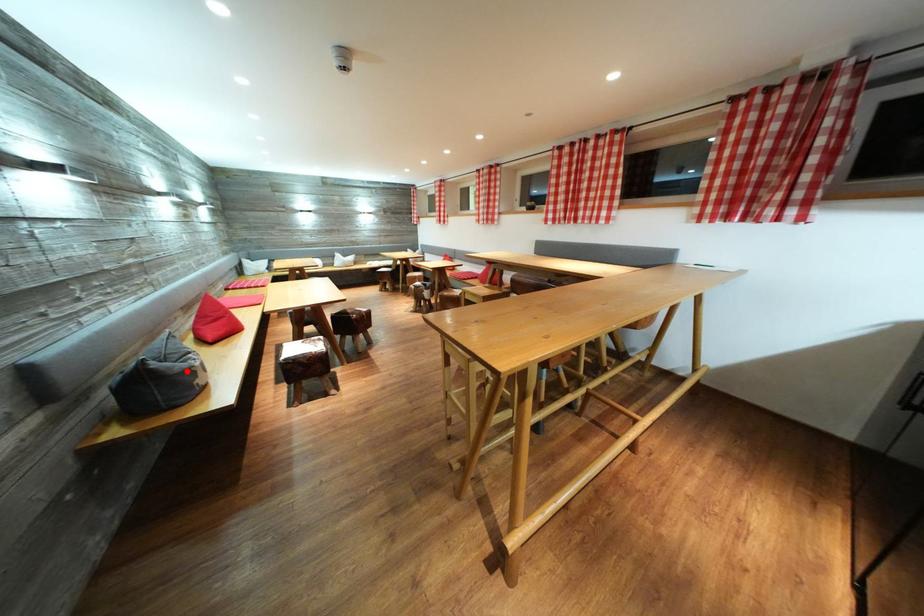
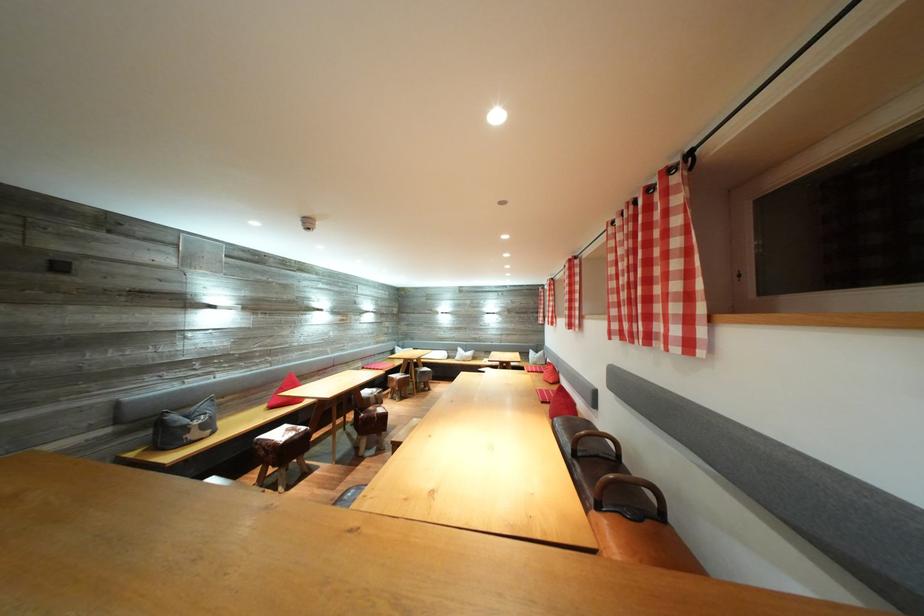
The point at the highlighted location is marked in the first image. Where is the corresponding point in the second image?

(192, 427)